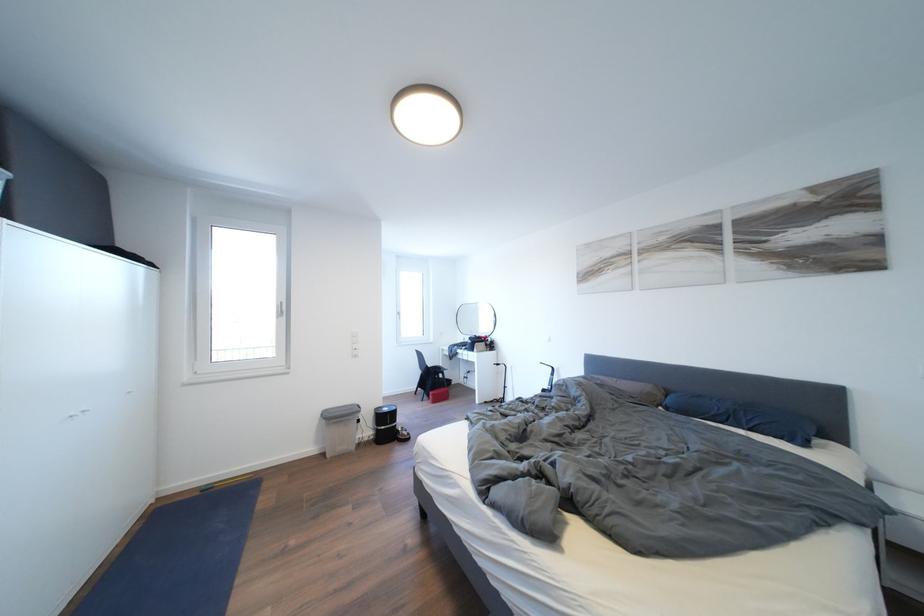
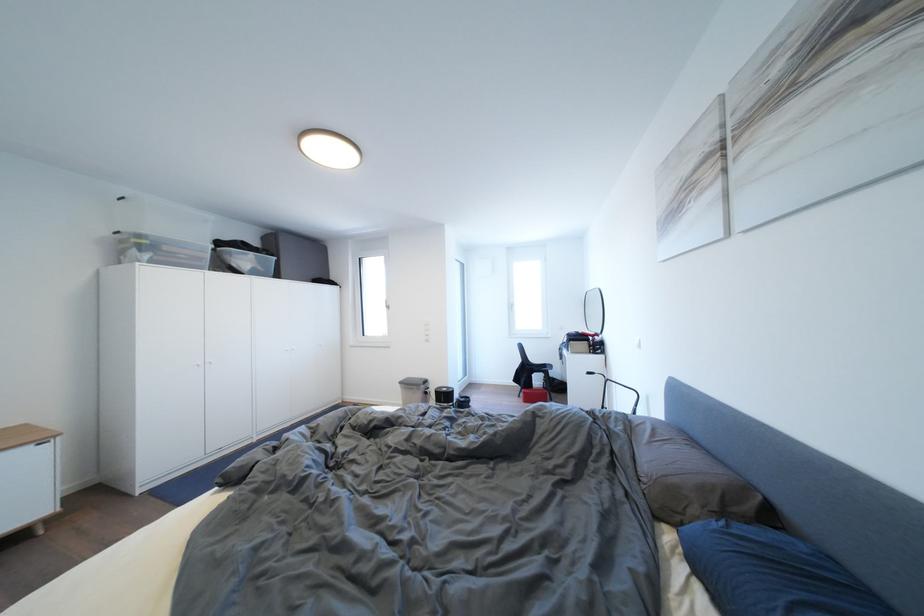
Locate, in the second image, the point that corresponds to [441,400] in the first image.

(532, 398)